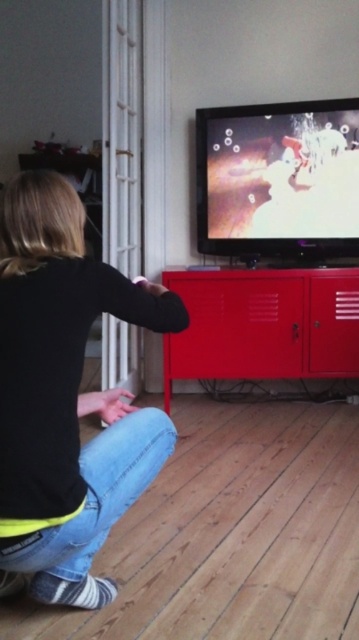
Which is behind, point (2, 429) or point (244, 298)?

Positioned behind is point (244, 298).

Looking at this image, who is positioned more to the right, black matte shirt at lower left or metallic red cabinet at center?

metallic red cabinet at center is more to the right.

Between point (20, 220) and point (263, 321), which one is positioned behind?

The point (263, 321) is behind.

The height and width of the screenshot is (640, 359). Identify the location of black matte shirt at lower left. (66, 394).